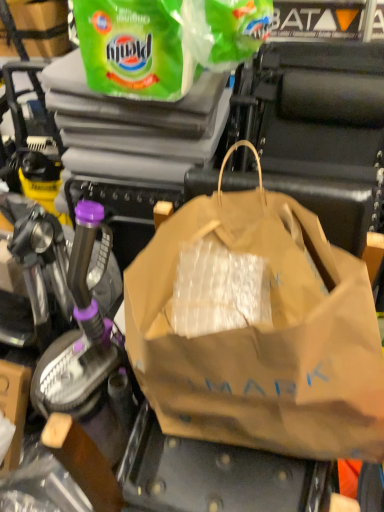
Question: Can you confirm if brown paper bag at center, arranged as the 2th plastic bag when viewed from the top, is bigger than green plastic bag at upper center, which ranks as the 2th plastic bag in bottom-to-top order?

Choices:
 (A) no
 (B) yes

Answer: (B)

Question: Is brown paper bag at center, which is the first plastic bag from bottom to top, outside of green plastic bag at upper center, arranged as the 1th plastic bag when viewed from the top?

Choices:
 (A) no
 (B) yes

Answer: (B)

Question: Is brown paper bag at center, which is the first plastic bag from bottom to top, not close to green plastic bag at upper center, which ranks as the 2th plastic bag in bottom-to-top order?

Choices:
 (A) no
 (B) yes

Answer: (A)

Question: Does brown paper bag at center, which is the first plastic bag from bottom to top, come in front of green plastic bag at upper center, arranged as the 1th plastic bag when viewed from the top?

Choices:
 (A) yes
 (B) no

Answer: (A)

Question: Is brown paper bag at center, arranged as the 2th plastic bag when viewed from the top, positioned with its back to green plastic bag at upper center, arranged as the 1th plastic bag when viewed from the top?

Choices:
 (A) yes
 (B) no

Answer: (A)

Question: From a real-world perspective, is brown paper bag at center, arranged as the 2th plastic bag when viewed from the top, below green plastic bag at upper center, which ranks as the 2th plastic bag in bottom-to-top order?

Choices:
 (A) yes
 (B) no

Answer: (A)

Question: Could you tell me if green plastic bag at upper center, arranged as the 1th plastic bag when viewed from the top, is turned towards brown paper bag at center, which is the first plastic bag from bottom to top?

Choices:
 (A) no
 (B) yes

Answer: (A)

Question: From the image's perspective, is green plastic bag at upper center, arranged as the 1th plastic bag when viewed from the top, below brown paper bag at center, which is the first plastic bag from bottom to top?

Choices:
 (A) no
 (B) yes

Answer: (A)

Question: Is the depth of green plastic bag at upper center, which ranks as the 2th plastic bag in bottom-to-top order, greater than that of brown paper bag at center, which is the first plastic bag from bottom to top?

Choices:
 (A) yes
 (B) no

Answer: (A)

Question: Considering the relative sizes of green plastic bag at upper center, which ranks as the 2th plastic bag in bottom-to-top order, and brown paper bag at center, arranged as the 2th plastic bag when viewed from the top, in the image provided, is green plastic bag at upper center, which ranks as the 2th plastic bag in bottom-to-top order, bigger than brown paper bag at center, arranged as the 2th plastic bag when viewed from the top,?

Choices:
 (A) no
 (B) yes

Answer: (A)

Question: Does green plastic bag at upper center, arranged as the 1th plastic bag when viewed from the top, have a lesser width compared to brown paper bag at center, which is the first plastic bag from bottom to top?

Choices:
 (A) no
 (B) yes

Answer: (B)

Question: Can we say green plastic bag at upper center, arranged as the 1th plastic bag when viewed from the top, lies outside brown paper bag at center, arranged as the 2th plastic bag when viewed from the top?

Choices:
 (A) yes
 (B) no

Answer: (A)

Question: From a real-world perspective, is brown paper bag at center, which is the first plastic bag from bottom to top, physically located above or below green plastic bag at upper center, which ranks as the 2th plastic bag in bottom-to-top order?

Choices:
 (A) above
 (B) below

Answer: (B)